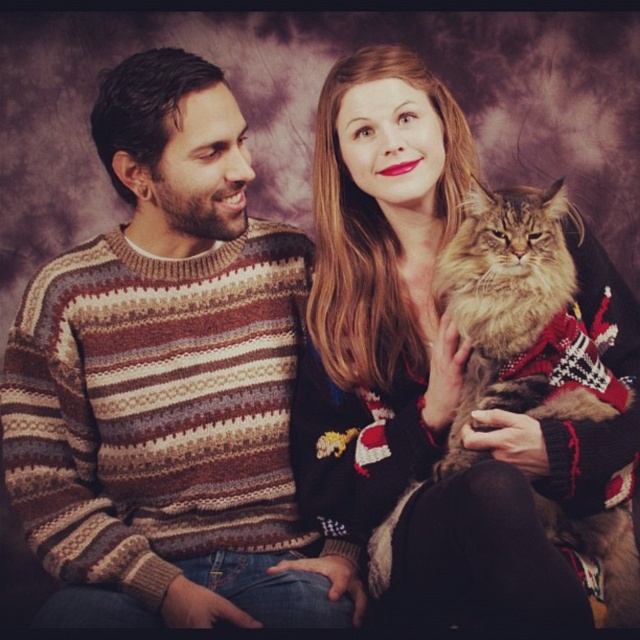
I want to click on knitted sweater at left, so click(168, 385).

Does knitted sweater at left come behind smooth black sweater at upper right?

Yes, it is.

Which is in front, point (260, 413) or point (369, 381)?

Point (369, 381) is in front.

The height and width of the screenshot is (640, 640). In order to click on knitted sweater at left in this screenshot , I will do `click(168, 385)`.

Is point (125, 97) positioned behind point (509, 205)?

Yes, it is behind point (509, 205).

The height and width of the screenshot is (640, 640). What are the coordinates of `knitted sweater at left` in the screenshot? It's located at (168, 385).

Which is above, smooth black sweater at upper right or fuzzy brown cat at right?

smooth black sweater at upper right

Is smooth black sweater at upper right taller than fuzzy brown cat at right?

Yes.

The width and height of the screenshot is (640, 640). Find the location of `smooth black sweater at upper right`. smooth black sweater at upper right is located at coordinates pos(442,371).

Where is `smooth black sweater at upper right`? This screenshot has width=640, height=640. smooth black sweater at upper right is located at coordinates (442, 371).